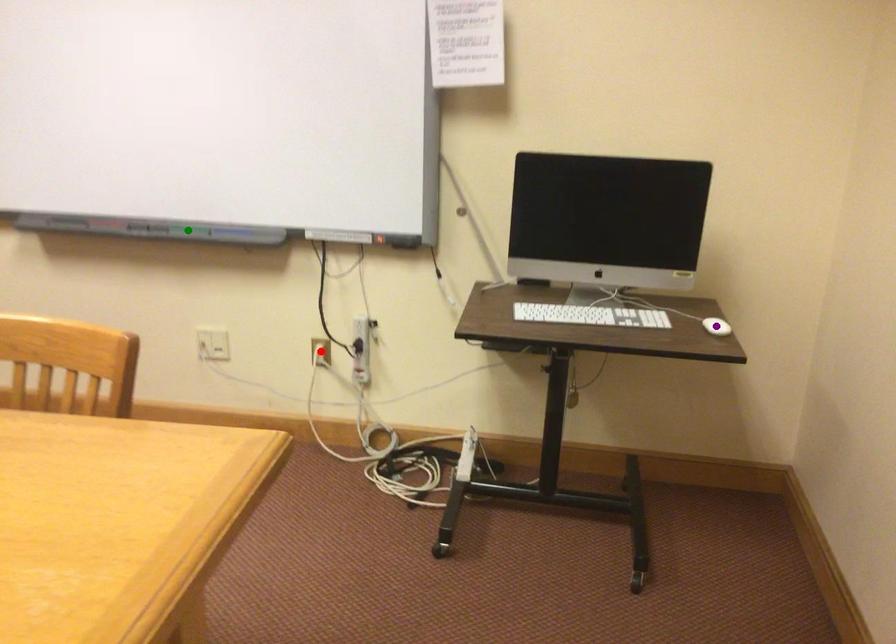
Order these from nearest to farthest:
green point, purple point, red point

purple point → green point → red point